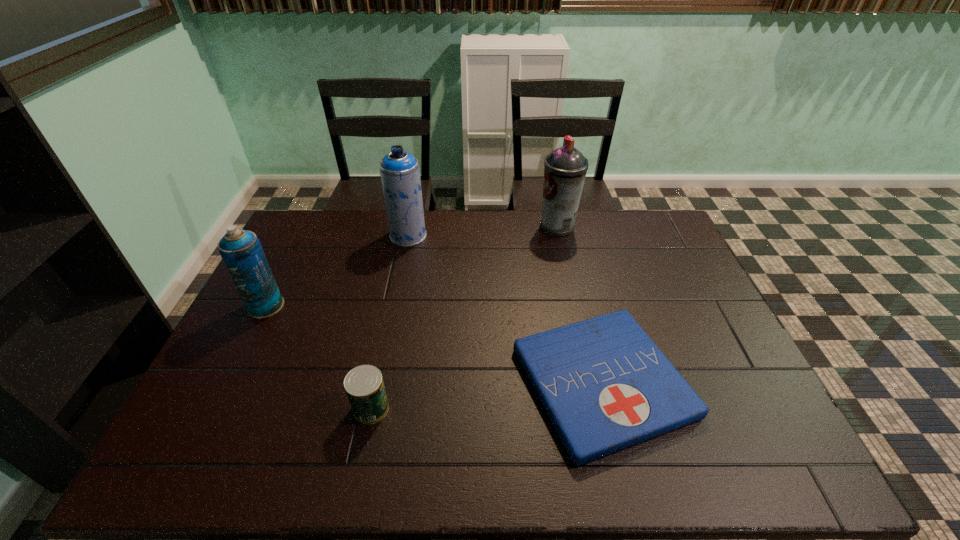
Locate an element on the screen. The height and width of the screenshot is (540, 960). the rightmost aerosol can is located at coordinates (565, 169).

Identify the location of the second aerosol can from right to left. (400, 175).

What are the coordinates of `the shortest aerosol can` in the screenshot? It's located at (241, 251).

This screenshot has width=960, height=540. Find the location of `the leftmost aerosol can`. the leftmost aerosol can is located at coordinates (241, 251).

You are a GUI agent. You are given a task and a screenshot of the screen. Output one action in this format:
    pyautogui.click(x=<x>, y=<y>)
    Task: Click on the can
    This screenshot has width=960, height=540.
    Given the screenshot: What is the action you would take?
    pyautogui.click(x=364, y=386)

In order to click on the shortest object in this screenshot , I will do `click(605, 385)`.

I want to click on vacant space located 0.290m on the front of the rightmost aerosol can, so click(572, 294).

The image size is (960, 540). I want to click on free space located 0.310m on the front of the second aerosol can from left to right, so click(x=394, y=311).

Find the location of a particular element. This screenshot has height=540, width=960. free space located on the right of the shortest aerosol can is located at coordinates (310, 306).

Locate an element on the screen. vacant area situated 0.360m on the left of the second shortest object is located at coordinates (206, 408).